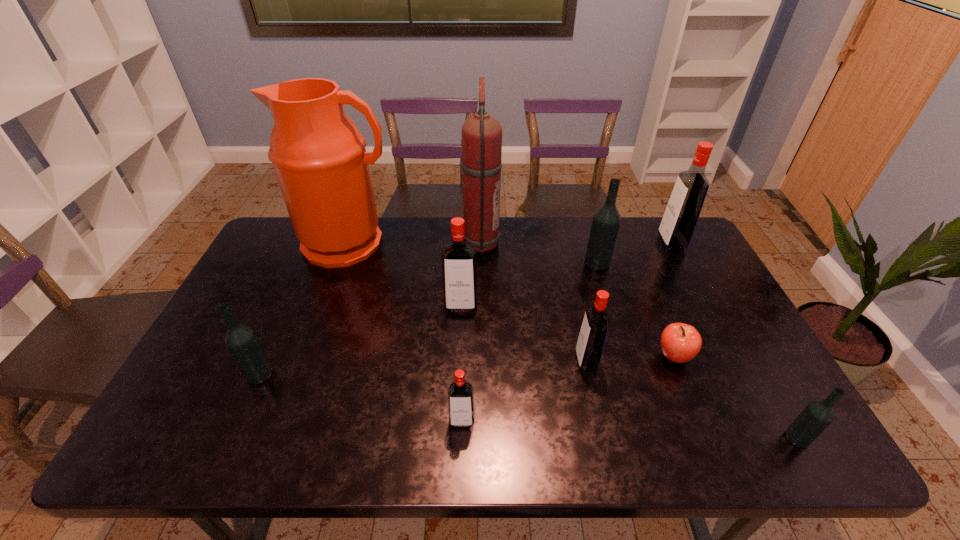
The image size is (960, 540). I want to click on free point located on the front and back of the rightmost red vodka, so click(608, 243).

I want to click on free location located 0.090m on the front and back of the rightmost red vodka, so click(x=634, y=243).

You are a GUI agent. You are given a task and a screenshot of the screen. Output one action in this format:
    pyautogui.click(x=<x>, y=<y>)
    Task: Click on the vacant area situated on the left of the seventh object from left to right
    This screenshot has width=960, height=540.
    Given the screenshot: What is the action you would take?
    pyautogui.click(x=476, y=262)

The height and width of the screenshot is (540, 960). I want to click on vacant space located on the front and back of the second farthest red vodka, so click(457, 404).

The width and height of the screenshot is (960, 540). Identify the location of free space located 0.350m on the back of the second biggest black vodka. (304, 273).

At what (x,y) coordinates should I click in order to perform the action: click on vacant space located on the front and back of the second smallest red vodka. Please return your answer as a coordinate pair (x, y). The width and height of the screenshot is (960, 540). Looking at the image, I should click on (545, 361).

At what (x,y) coordinates should I click in order to perform the action: click on free space located 0.150m on the front and back of the second smallest red vodka. Please return your answer as a coordinate pair (x, y). Looking at the image, I should click on (518, 361).

Where is `free space located 0.380m on the front and back of the second smallest red vodka`? free space located 0.380m on the front and back of the second smallest red vodka is located at coordinates (429, 361).

At what (x,y) coordinates should I click in order to perform the action: click on vacant region located 0.050m on the front and back of the smallest red vodka. Please return your answer as a coordinate pair (x, y). Looking at the image, I should click on coord(461,450).

Where is `vacant space located on the left of the smallest black vodka`? vacant space located on the left of the smallest black vodka is located at coordinates (755, 438).